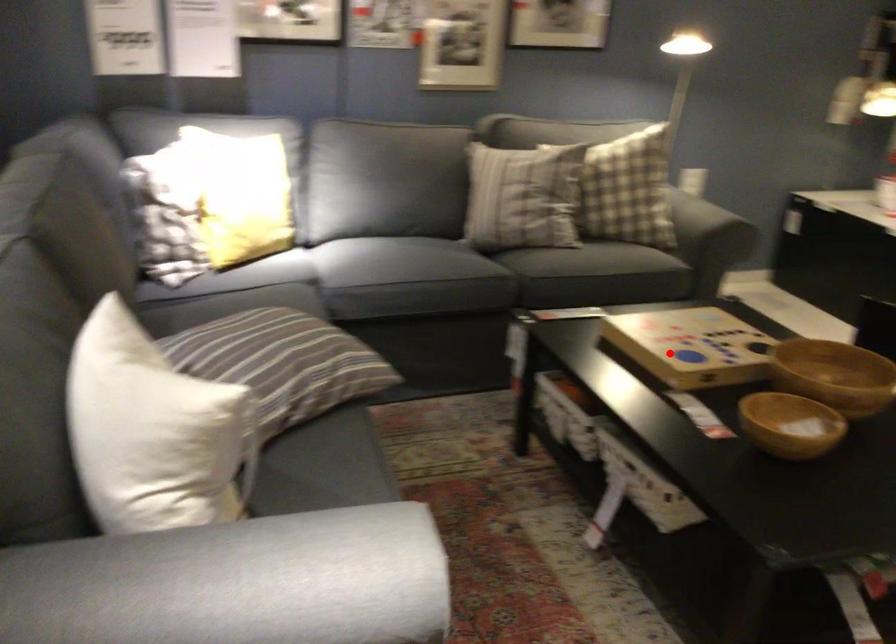
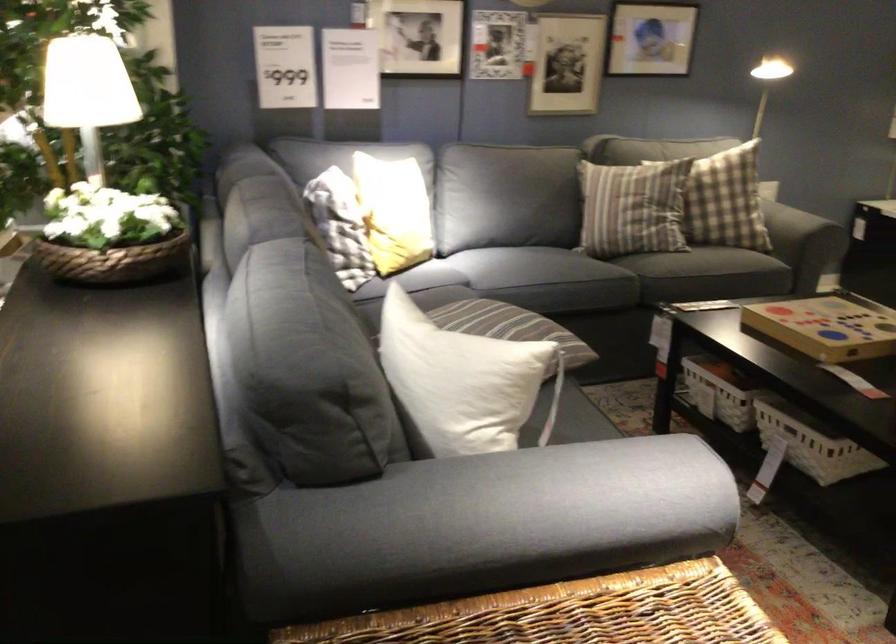
Question: I am providing you with two images of the same scene from different viewpoints. Given a red point in image1, look at the same physical point in image2. Is it:

Choices:
 (A) Closer to the viewpoint
 (B) Farther from the viewpoint

Answer: (B)